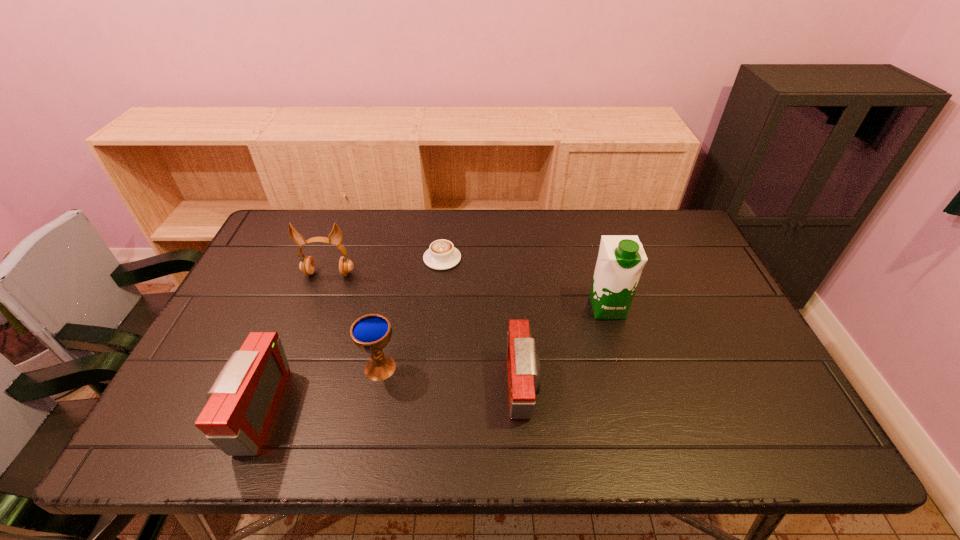
Identify the location of chalice that is at the near edge. This screenshot has height=540, width=960. (370, 333).

Locate an element on the screen. object located in the left edge section of the desktop is located at coordinates (242, 402).

This screenshot has height=540, width=960. I want to click on object that is at the near left corner, so click(242, 402).

In the image, there is a desktop. Where is `vacant space at the far edge`? This screenshot has height=540, width=960. vacant space at the far edge is located at coordinates (603, 216).

Image resolution: width=960 pixels, height=540 pixels. In order to click on vacant space at the near edge of the desktop in this screenshot , I will do `click(447, 382)`.

Where is `vacant space at the left edge of the desktop`? vacant space at the left edge of the desktop is located at coordinates (240, 346).

I want to click on free region at the right edge of the desktop, so click(x=713, y=346).

In the image, there is a desktop. At what (x,y) coordinates should I click in order to perform the action: click on free space at the near left corner. Please return your answer as a coordinate pair (x, y). Image resolution: width=960 pixels, height=540 pixels. Looking at the image, I should click on (205, 394).

In the image, there is a desktop. Where is `free space at the near right corner`? free space at the near right corner is located at coordinates tap(738, 378).

Image resolution: width=960 pixels, height=540 pixels. I want to click on free space between the left camera and the cappuccino, so click(349, 335).